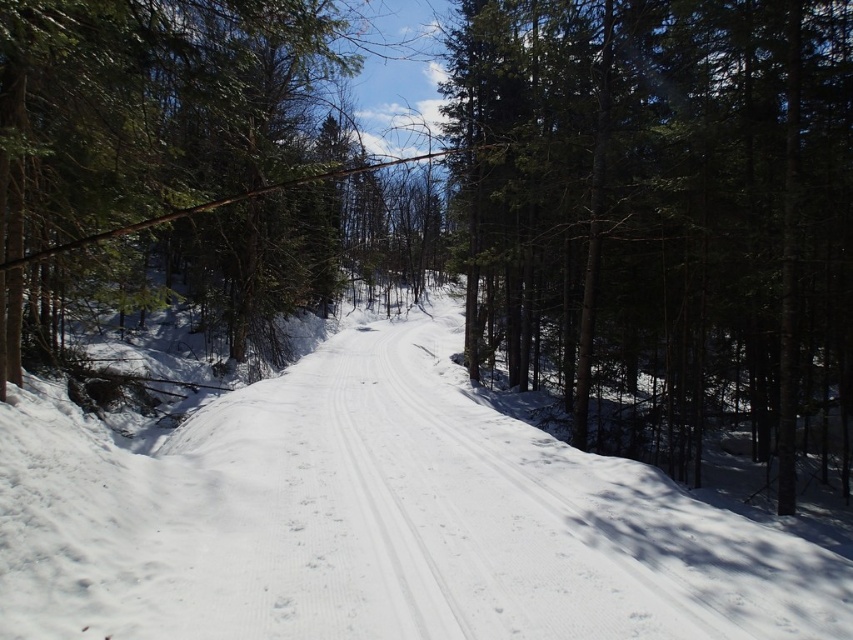
Looking at this image, you are standing at the starting point of the snow path in the forest. You see two points marked on the path ahead of you. The first is at point (720, 528) and the second is at point (757, 132). Which point is closer to you as you walk along the path?

Point (720, 528) is closer to you because it is in front of point (757, 132) along the path.

You are an outdoor enthusiast planning to cross the snow path. You see the white powdery snow at center and the green textured tree at center. Which one covers a smaller area in the scene?

The white powdery snow at center occupies less space than the green textured tree at center, so the white powdery snow at center covers a smaller area in the scene.